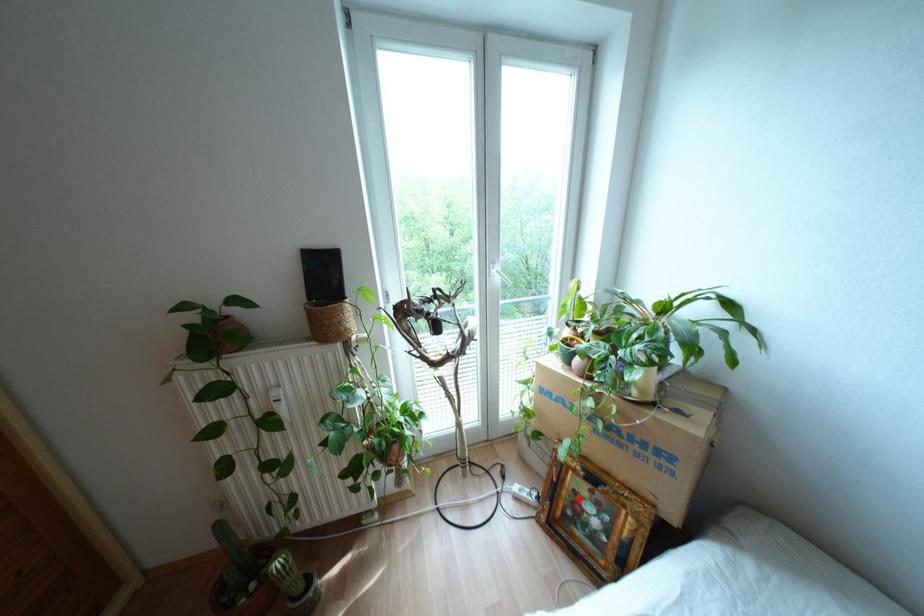
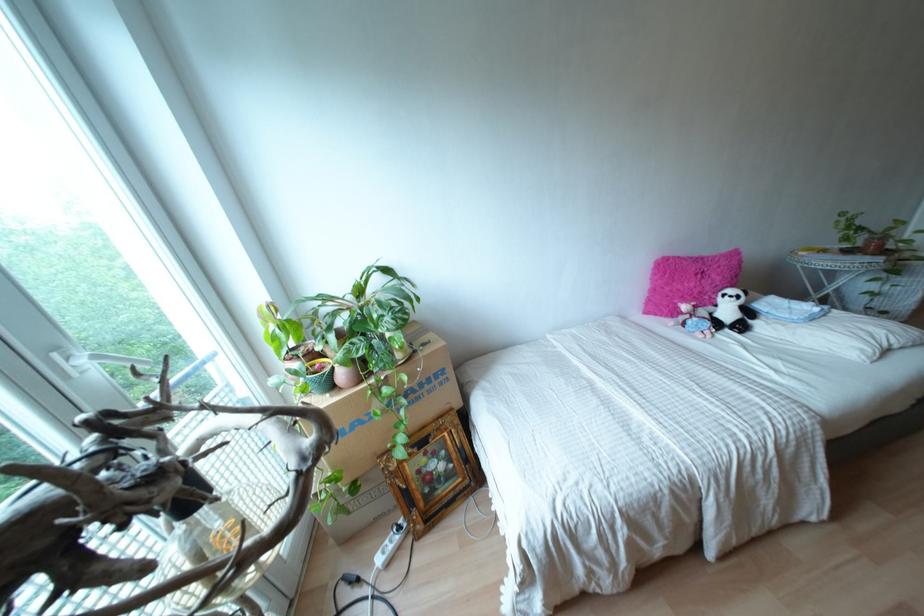
Question: I am providing you with two images of the same scene from different viewpoints. Image1 has a red point marked. In image2, the corresponding 3D location appears at what relative position? Reply with the corresponding letter.

Choices:
 (A) Closer
 (B) Farther

Answer: (B)